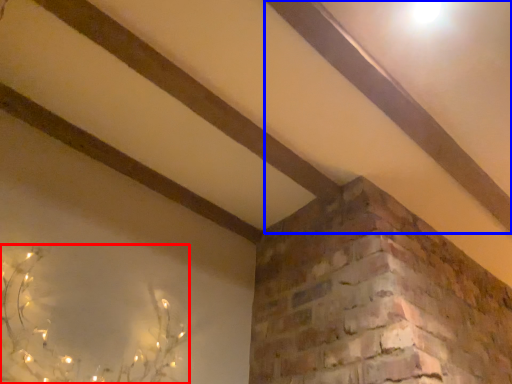
Question: Which point is further to the camera, plant (highlighted by a red box) or plank (highlighted by a blue box)?

Choices:
 (A) plant
 (B) plank

Answer: (B)